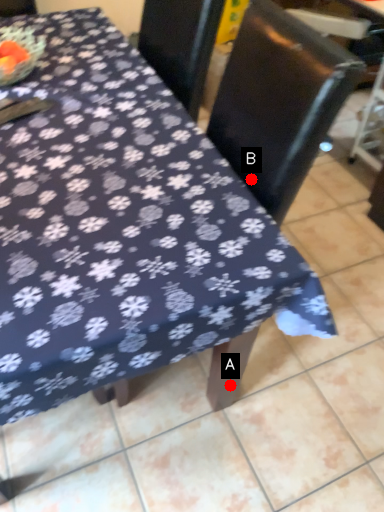
Question: Two points are circled on the image, labeled by A and B beside each circle. Which point is farther to the camera?

Choices:
 (A) A is further
 (B) B is further

Answer: (A)